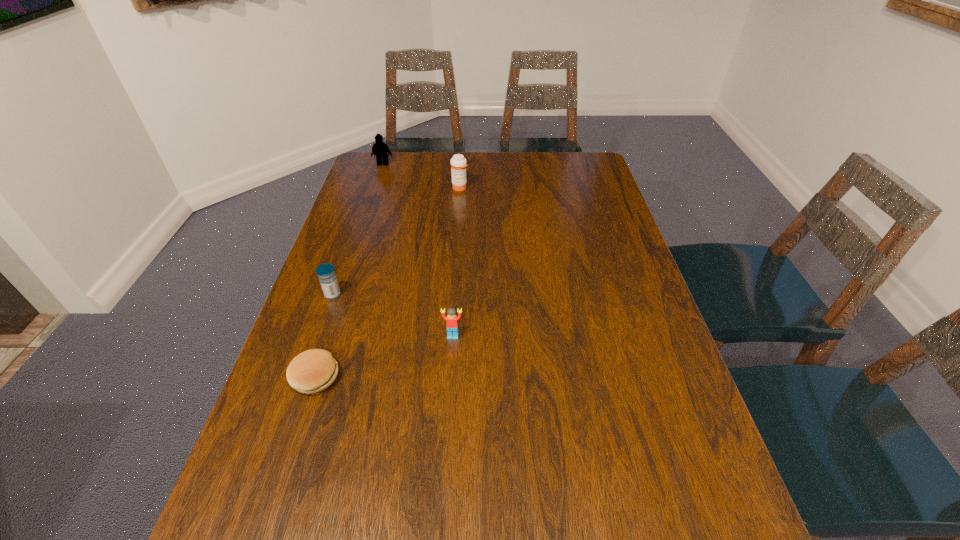
The height and width of the screenshot is (540, 960). Identify the location of the second farthest object. (458, 163).

In order to click on the right medicine in this screenshot , I will do `click(458, 163)`.

Image resolution: width=960 pixels, height=540 pixels. In order to click on the farthest object in this screenshot , I will do `click(380, 149)`.

In order to click on the farther Lego in this screenshot , I will do `click(380, 149)`.

Identify the location of the right Lego. The width and height of the screenshot is (960, 540). (452, 319).

Find the location of a particular element. This screenshot has height=540, width=960. the nearer Lego is located at coordinates [452, 319].

This screenshot has width=960, height=540. I want to click on the left medicine, so click(x=326, y=273).

Find the location of `the nearer medicine`. the nearer medicine is located at coordinates (326, 273).

This screenshot has height=540, width=960. I want to click on the nearest object, so click(311, 372).

Image resolution: width=960 pixels, height=540 pixels. I want to click on patty, so coord(311,372).